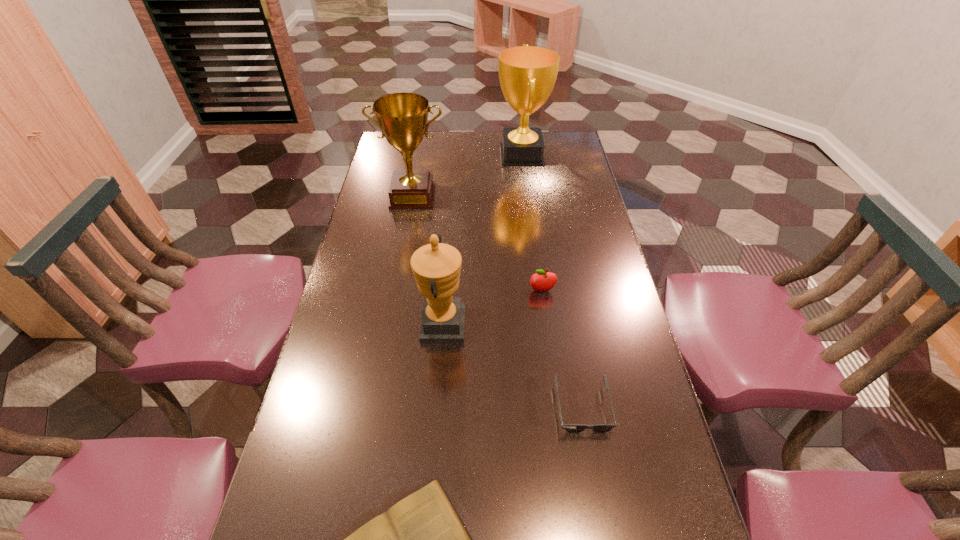
This screenshot has height=540, width=960. What are the coordinates of `object that can be found as the fifth closest to the shortest object` in the screenshot? It's located at (527, 74).

Point out which award is positioned as the third nearest to the book. Please provide its 2D coordinates. Your answer should be formatted as a tuple, i.e. [(x, y)], where the tuple contains the x and y coordinates of a point satisfying the conditions above.

[(527, 74)]

Locate an element on the screen. This screenshot has height=540, width=960. the second closest award to the second farthest object is located at coordinates (436, 266).